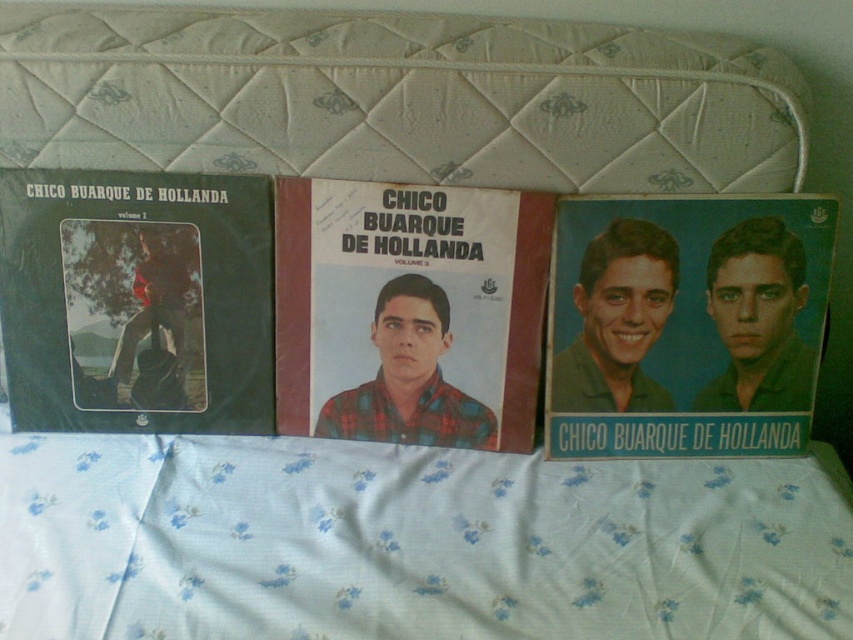
Question: Is white fabric at upper center wider than plaid fabric album cover at center?

Choices:
 (A) no
 (B) yes

Answer: (B)

Question: Considering the real-world distances, which object is closest to the plaid fabric album cover at center?

Choices:
 (A) blue matte poster at center
 (B) white fabric at upper center

Answer: (A)

Question: Based on their relative distances, which object is nearer to the plaid fabric album cover at center?

Choices:
 (A) green matte vinyl record at left
 (B) blue matte poster at center

Answer: (A)

Question: Estimate the real-world distances between objects in this image. Which object is farther from the blue matte poster at center?

Choices:
 (A) plaid fabric album cover at center
 (B) green matte vinyl record at left

Answer: (B)

Question: Is white fabric at upper center below green matte vinyl record at left?

Choices:
 (A) yes
 (B) no

Answer: (A)

Question: Can you confirm if white fabric at upper center is positioned below blue matte poster at center?

Choices:
 (A) no
 (B) yes

Answer: (B)